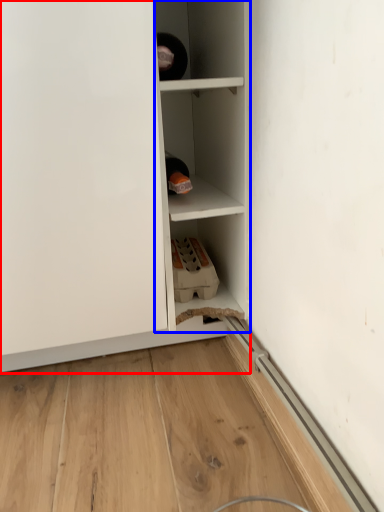
Question: Which object appears farthest to the camera in this image, cupboard (highlighted by a red box) or cabinetry (highlighted by a blue box)?

Choices:
 (A) cupboard
 (B) cabinetry

Answer: (B)